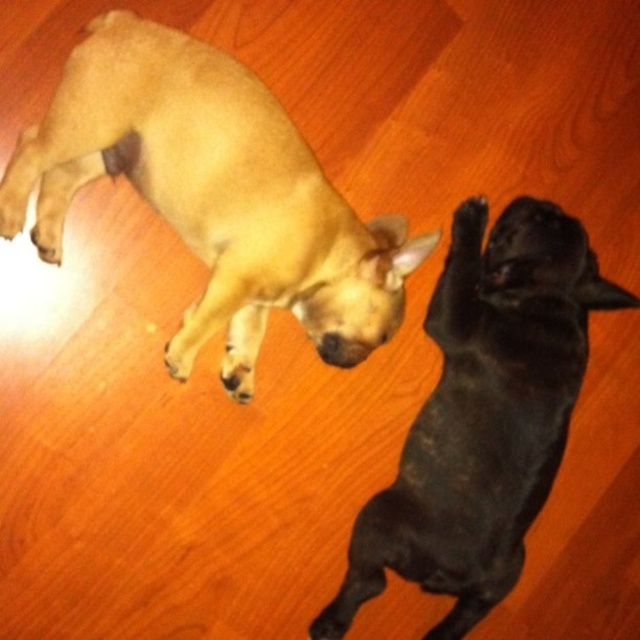
Can you confirm if light brown fur dog at upper left is thinner than black matte dog at upper right?

No.

Locate an element on the screen. The image size is (640, 640). light brown fur dog at upper left is located at coordinates (212, 195).

Identify the location of light brown fur dog at upper left. (212, 195).